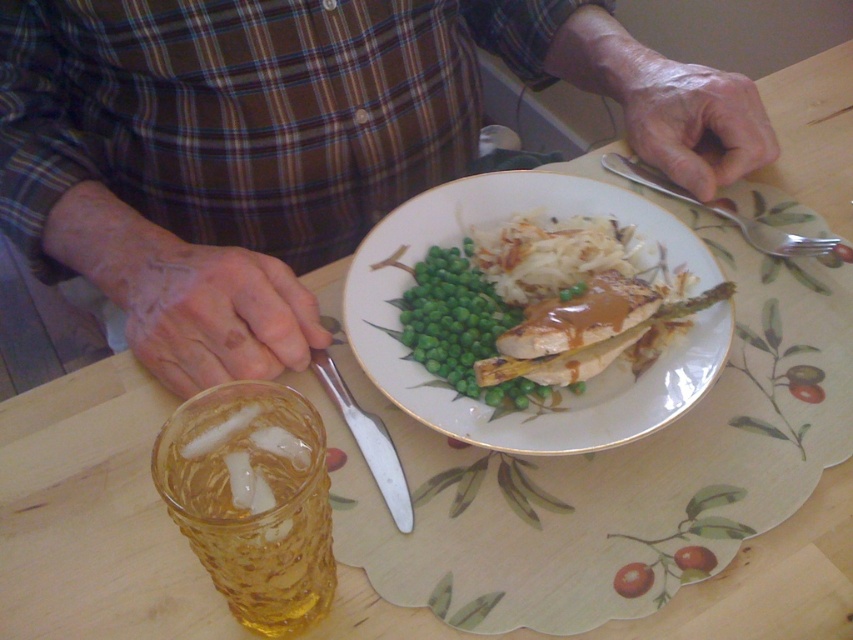
Between translucent amber glass at lower left and silver spoon at upper right, which one is positioned lower?

translucent amber glass at lower left

Does translucent amber glass at lower left come behind silver spoon at upper right?

No, translucent amber glass at lower left is in front of silver spoon at upper right.

Between point (315, 436) and point (656, 180), which one is positioned in front?

Point (315, 436) is in front.

Image resolution: width=853 pixels, height=640 pixels. What are the coordinates of `translucent amber glass at lower left` in the screenshot? It's located at (251, 497).

Does white glossy plate at center have a larger size compared to silver metallic knife at center?

Indeed, white glossy plate at center has a larger size compared to silver metallic knife at center.

Does point (531, 176) come in front of point (383, 442)?

No.

Does point (666, 417) come behind point (381, 481)?

No, (666, 417) is in front of (381, 481).

In order to click on white glossy plate at center in this screenshot , I will do `click(563, 394)`.

What do you see at coordinates (288, 145) in the screenshot?
I see `brown plaid shirt at center` at bounding box center [288, 145].

Image resolution: width=853 pixels, height=640 pixels. Describe the element at coordinates (288, 145) in the screenshot. I see `brown plaid shirt at center` at that location.

This screenshot has height=640, width=853. I want to click on brown plaid shirt at center, so click(288, 145).